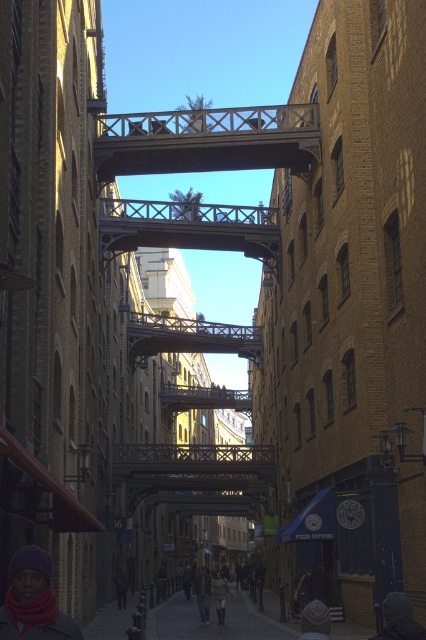
Question: Among these objects, which one is nearest to the camera?

Choices:
 (A) knitted woolen hat at lower left
 (B) metallic bridge at center

Answer: (A)

Question: Which object is closer to the camera taking this photo?

Choices:
 (A) dark gray jacket at lower center
 (B) light beige coat at center
 (C) knitted woolen hat at lower left

Answer: (C)

Question: Does wooden bridge at center appear over dark gray knit hat at lower right?

Choices:
 (A) no
 (B) yes

Answer: (B)

Question: Which of these objects is positioned closest to the metallic bridge at center?

Choices:
 (A) light brown leather jacket at center
 (B) knitted wool hat at lower center
 (C) dark gray knit hat at lower right

Answer: (A)

Question: Is knitted woolen hat at lower left smaller than knitted wool hat at lower center?

Choices:
 (A) yes
 (B) no

Answer: (A)

Question: Does dark gray knit hat at lower right come behind dark gray jacket at lower center?

Choices:
 (A) no
 (B) yes

Answer: (A)